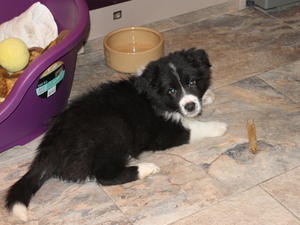
This screenshot has height=225, width=300. What are the coordinates of `tile flooring` in the screenshot? It's located at pyautogui.click(x=238, y=109).